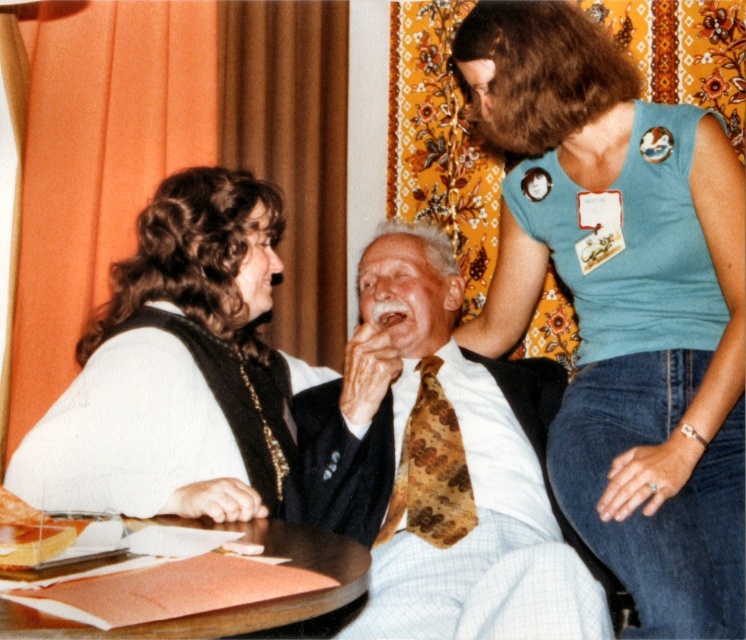
You are a photographer adjusting the lighting in the scene. You notice the blue fabric shirt at upper right and the floral tie at center. Which object is closer to the camera?

The blue fabric shirt at upper right is closer to the camera because the floral tie at center is behind it.

You are standing in front of the scene and want to touch the blue fabric shirt at upper right and the white fuzzy vest at left. Which one can you reach without moving your position?

The blue fabric shirt at upper right is closer to you, so you can reach it without moving your position, while the white fuzzy vest at left is farther away and might require moving.

You are standing in front of the table and want to pick up an object. There are two points marked on the table surface at coordinates point (x=673, y=253) and point (x=347, y=401). Which point is closer to you?

Point (x=673, y=253) is closer to the camera than point (x=347, y=401), so the point closer to you is point (x=673, y=253).